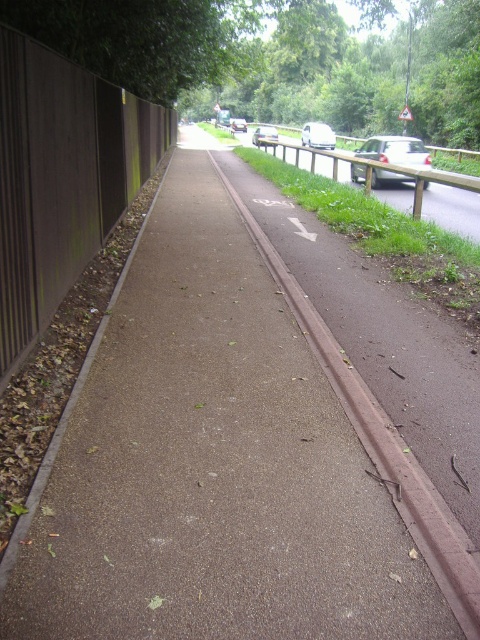
You are a cyclist approaching the pathway and see the white glossy van at center and the metallic silver car at center. Which vehicle is positioned more to the right side of the pathway?

The white glossy van at center is positioned more to the right side of the pathway compared to the metallic silver car at center.

You are a pedestrian standing at the start of the pathway. You see two vans, a white glossy van at center and a silver metallic van at center. Which van is positioned higher in the image?

A: The white glossy van at center is positioned higher in the image than the silver metallic van at center.

You are a cyclist approaching the pathway and see the silver metallic car at center and the metallic silver car at center. Which car is closer to you as you approach the pathway?

The silver metallic car at center is closer to you because it is in front of the metallic silver car at center.